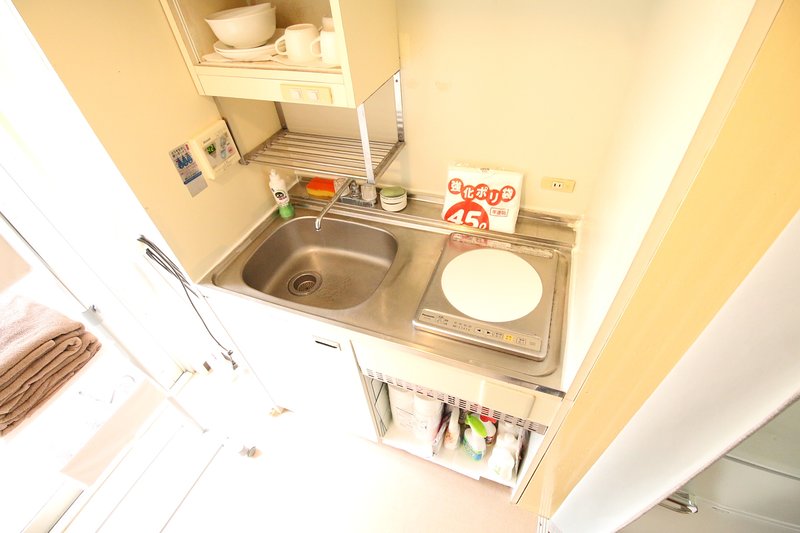
At what (x,y) coordinates should I click in order to perform the action: click on hot plates. Please return your answer as a coordinate pair (x, y). Image resolution: width=800 pixels, height=533 pixels. Looking at the image, I should click on click(482, 265).